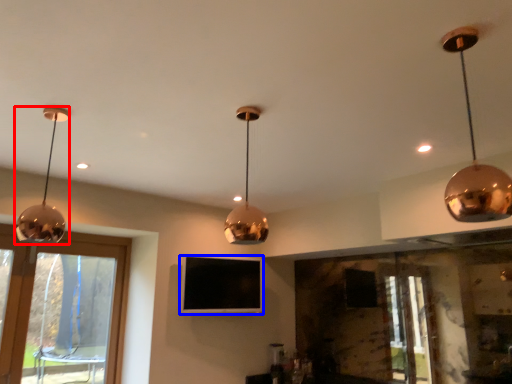
Question: Which point is further to the camera, lamp (highlighted by a red box) or television (highlighted by a blue box)?

Choices:
 (A) lamp
 (B) television

Answer: (B)